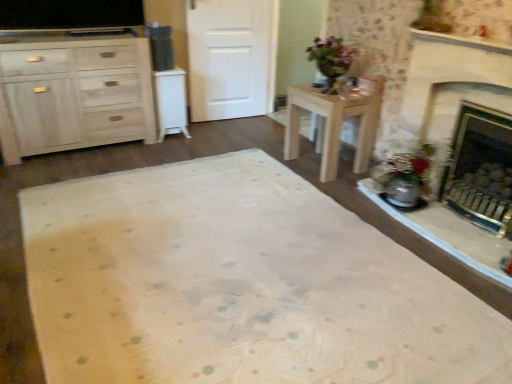
Question: Should I look upward or downward to see light wood cabinet at left, arranged as the second cabinetry when viewed from the right?

Choices:
 (A) up
 (B) down

Answer: (A)

Question: Can you confirm if light wood desk at center is positioned to the right of white matte door at center?

Choices:
 (A) no
 (B) yes

Answer: (B)

Question: Is light wood desk at center looking in the opposite direction of white matte door at center?

Choices:
 (A) no
 (B) yes

Answer: (A)

Question: Is the depth of light wood desk at center greater than that of white matte door at center?

Choices:
 (A) yes
 (B) no

Answer: (B)

Question: Is light wood desk at center smaller than white matte door at center?

Choices:
 (A) yes
 (B) no

Answer: (B)

Question: Is the position of light wood desk at center less distant than that of white matte door at center?

Choices:
 (A) yes
 (B) no

Answer: (A)

Question: Does light wood desk at center turn towards white matte door at center?

Choices:
 (A) yes
 (B) no

Answer: (B)

Question: Does brass fireplace at right lie behind light wood cabinet at left, arranged as the second cabinetry when viewed from the right?

Choices:
 (A) yes
 (B) no

Answer: (B)

Question: Is light wood cabinet at left, arranged as the second cabinetry when viewed from the right, surrounded by brass fireplace at right?

Choices:
 (A) yes
 (B) no

Answer: (B)

Question: Can you confirm if brass fireplace at right is taller than light wood cabinet at left, arranged as the second cabinetry when viewed from the right?

Choices:
 (A) yes
 (B) no

Answer: (A)

Question: From the image's perspective, is brass fireplace at right located beneath light wood cabinet at left, arranged as the second cabinetry when viewed from the right?

Choices:
 (A) yes
 (B) no

Answer: (A)

Question: Is brass fireplace at right wider than light wood cabinet at left, arranged as the second cabinetry when viewed from the right?

Choices:
 (A) yes
 (B) no

Answer: (B)

Question: Can you confirm if brass fireplace at right is positioned to the right of light wood cabinet at left, the first cabinetry when ordered from left to right?

Choices:
 (A) no
 (B) yes

Answer: (B)

Question: Is white matte cabinet at left, positioned as the 2th cabinetry in left-to-right order, closer to the viewer compared to brass fireplace at right?

Choices:
 (A) yes
 (B) no

Answer: (B)